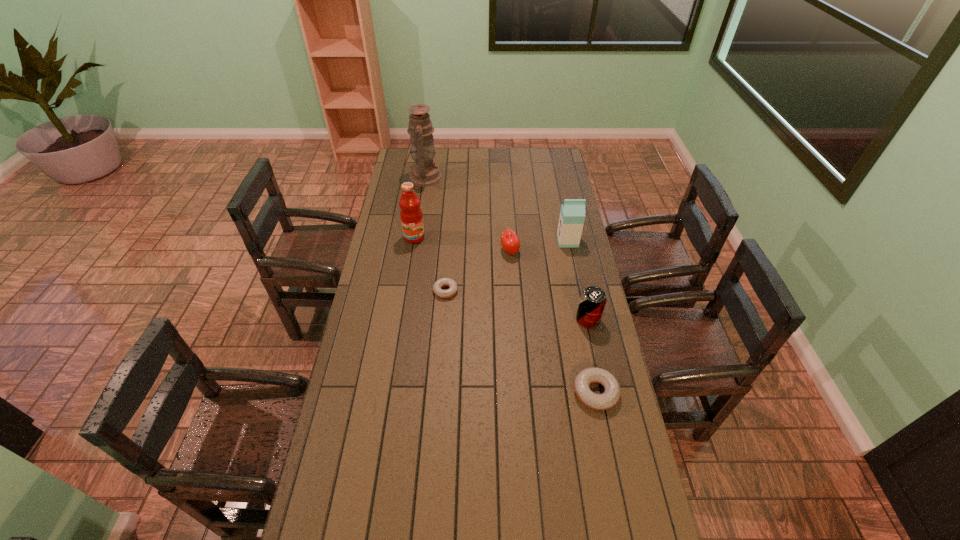
Please determine a free point for an extra doughnut to ensure balance. Please provide its 2D coordinates. Your answer should be formatted as a tuple, i.e. [(x, y)], where the tuple contains the x and y coordinates of a point satisfying the conditions above.

[(514, 336)]